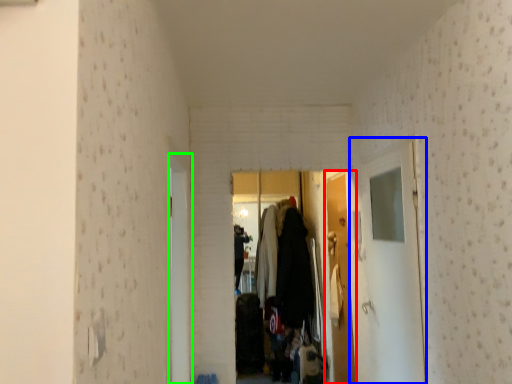
Question: Based on their relative distances, which object is nearer to door (highlighted by a red box)? Choose from glass door (highlighted by a blue box) and door (highlighted by a green box).

Choices:
 (A) glass door
 (B) door

Answer: (A)